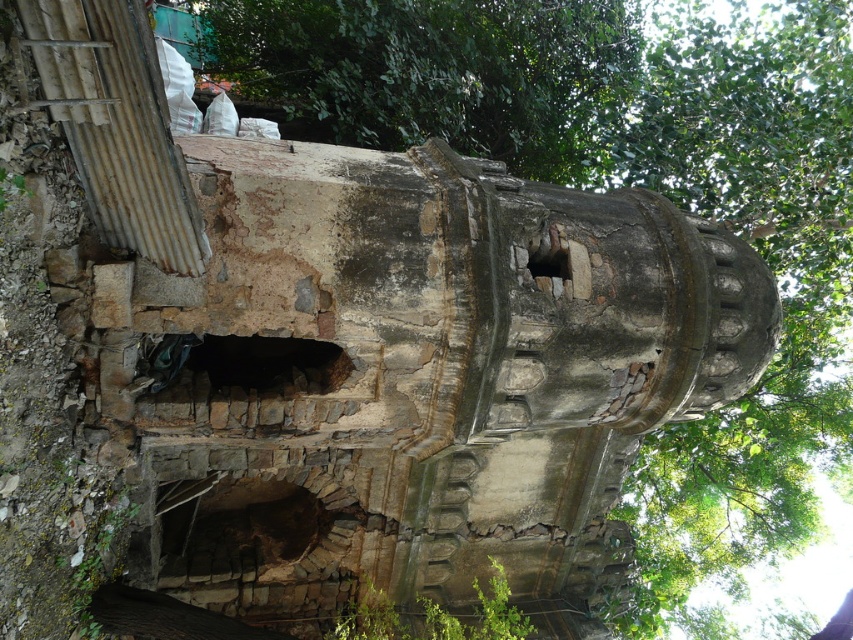
Question: Among these objects, which one is farthest from the camera?

Choices:
 (A) rusty metal hole at center
 (B) dark stone hole at center
 (C) brown stone hole at lower left

Answer: (C)

Question: Does dark stone hole at center have a smaller size compared to rusty metal hole at center?

Choices:
 (A) no
 (B) yes

Answer: (A)

Question: Does brown stone hole at lower left come in front of rusty metal hole at center?

Choices:
 (A) no
 (B) yes

Answer: (A)

Question: Estimate the real-world distances between objects in this image. Which object is closer to the brown stone hole at lower left?

Choices:
 (A) dark stone hole at center
 (B) rusty metal hole at center

Answer: (A)

Question: Does dark stone hole at center appear over rusty metal hole at center?

Choices:
 (A) no
 (B) yes

Answer: (A)

Question: Considering the real-world distances, which object is farthest from the dark stone hole at center?

Choices:
 (A) brown stone hole at lower left
 (B) rusty metal hole at center

Answer: (A)